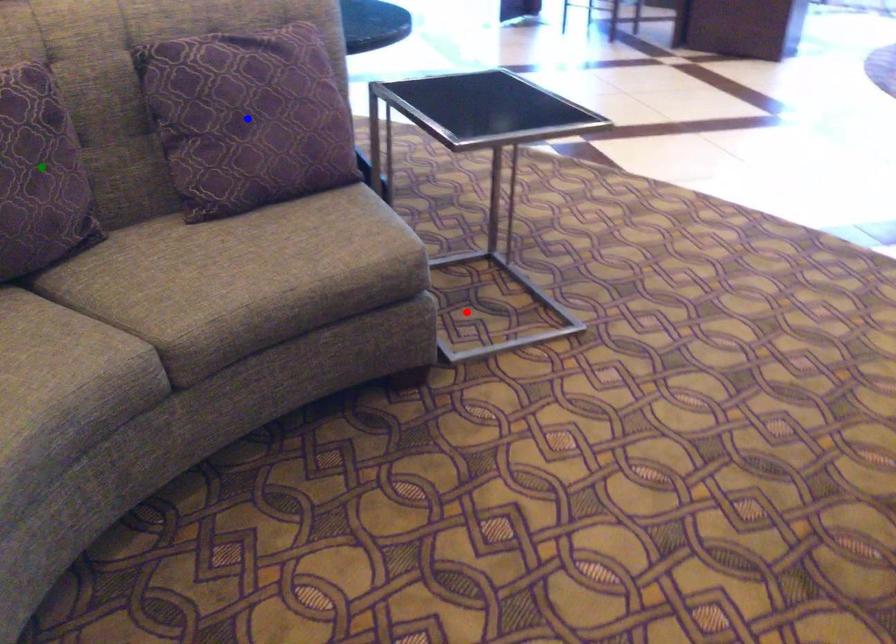
Order these from nearest to farthest:
green point
blue point
red point

red point < blue point < green point